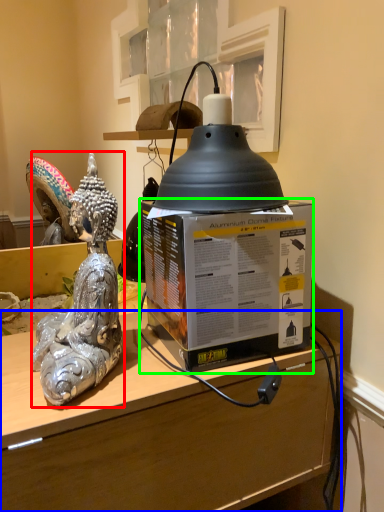
Question: Which object is positioned farthest from figurine (highlighted by a red box)? Select from desk (highlighted by a blue box) and box (highlighted by a green box).

Choices:
 (A) desk
 (B) box

Answer: (A)